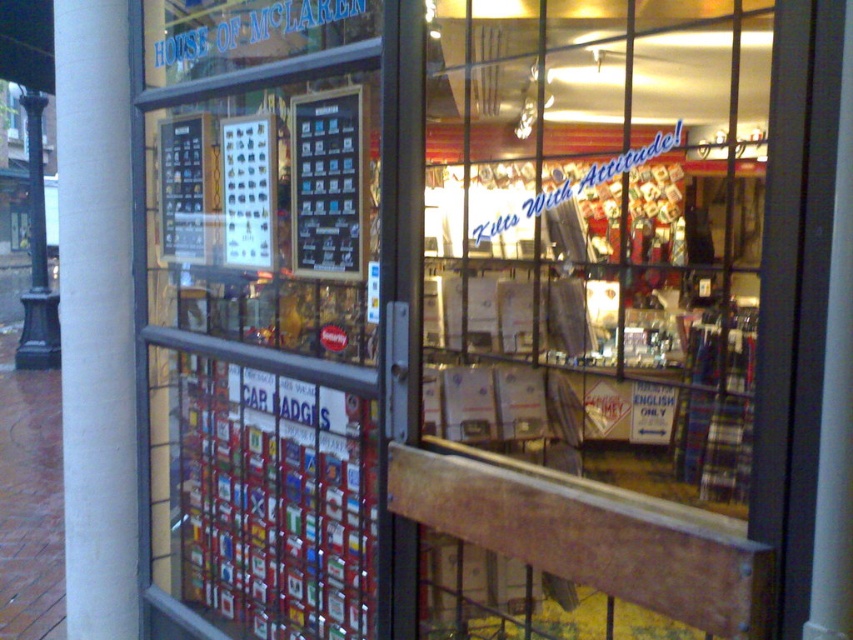
Question: Which object is positioned closest to the white smooth pillar at left?

Choices:
 (A) clear glass door at left
 (B) metallic silver badge at center

Answer: (A)

Question: Observing the image, what is the correct spatial positioning of white smooth pillar at left in reference to metallic silver badge at center?

Choices:
 (A) above
 (B) below

Answer: (B)

Question: Which object is closer to the camera taking this photo?

Choices:
 (A) clear glass door at left
 (B) metallic silver badge at center
 (C) white smooth pillar at left
 (D) transparent glass door at center

Answer: (A)

Question: Is transparent glass door at center wider than clear glass door at left?

Choices:
 (A) yes
 (B) no

Answer: (A)

Question: Observing the image, what is the correct spatial positioning of transparent glass door at center in reference to white smooth pillar at left?

Choices:
 (A) left
 (B) right

Answer: (B)

Question: Which of the following is the farthest from the observer?

Choices:
 (A) transparent glass door at center
 (B) clear glass door at left

Answer: (A)